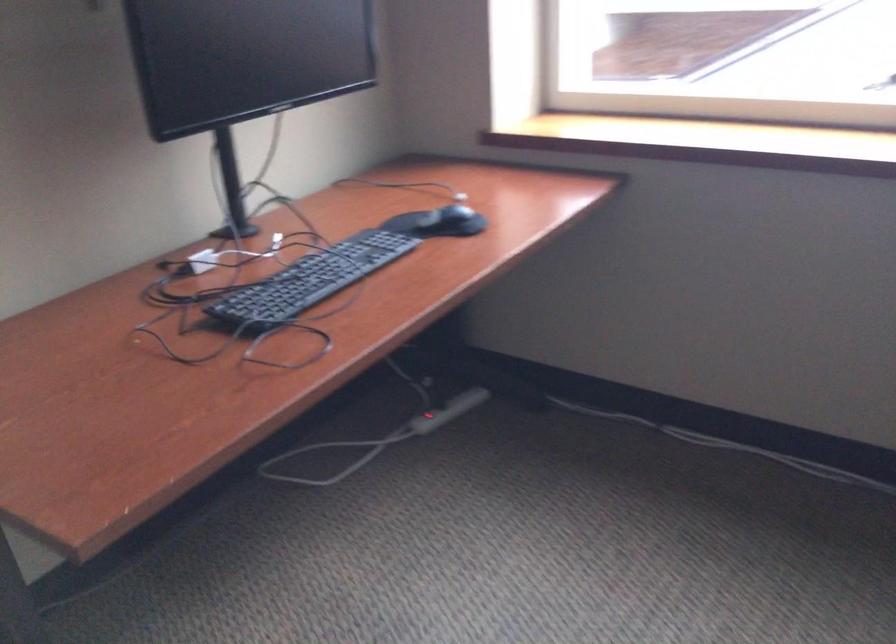
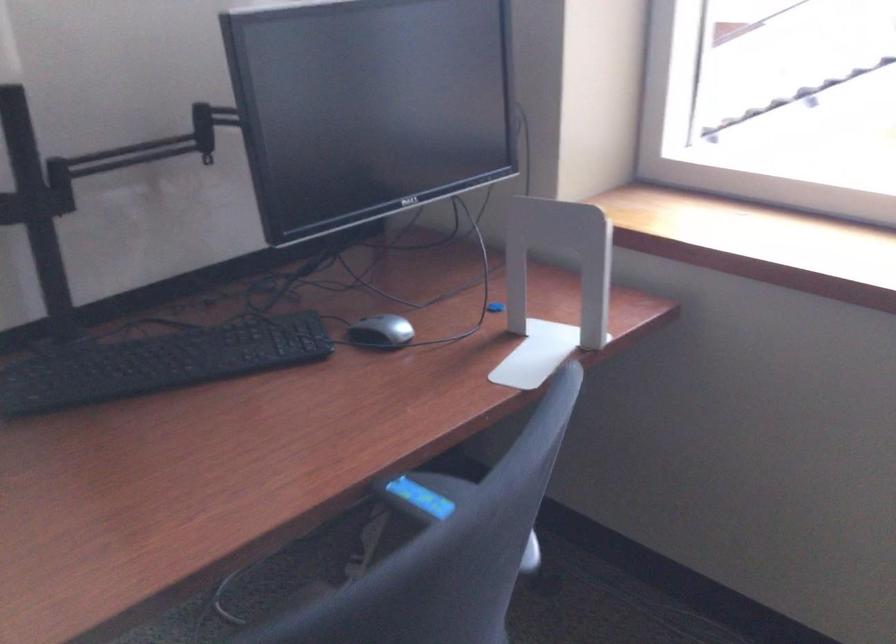
Question: In a continuous first-person perspective shot, in which direction is the camera moving?

Choices:
 (A) Left
 (B) Right
 (C) Forward
 (D) Backward

Answer: (B)